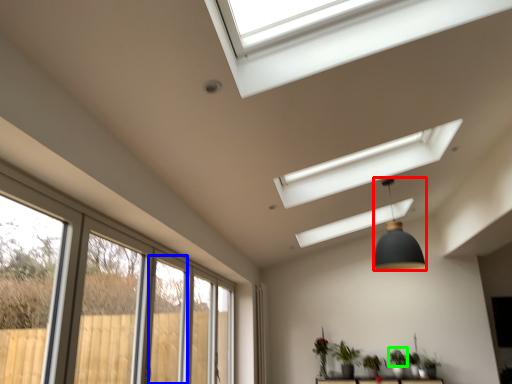
Question: Based on their relative distances, which object is nearer to light fixture (highlighted by a red box)? Choose from screen door (highlighted by a blue box) and plant (highlighted by a green box).

Choices:
 (A) screen door
 (B) plant

Answer: (A)